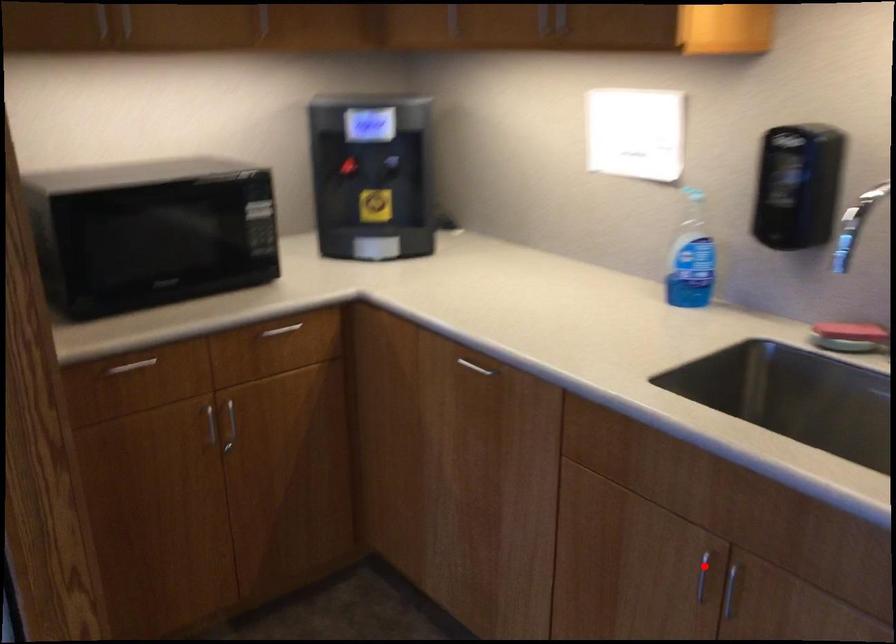
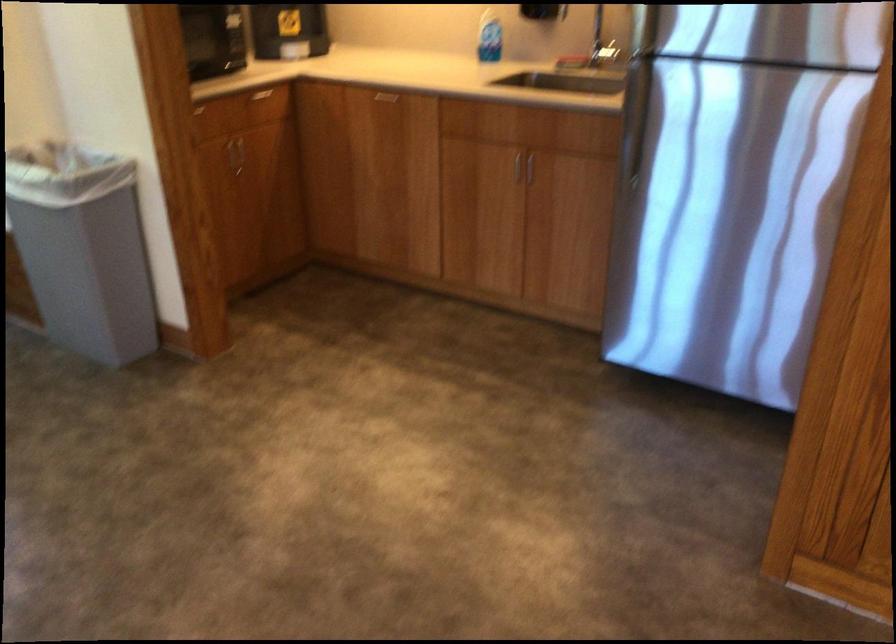
Question: I am providing you with two images of the same scene from different viewpoints. Image1 has a red point marked. In image2, the corresponding 3D location appears at what relative position? Reply with the corresponding letter.

Choices:
 (A) Closer
 (B) Farther

Answer: (B)